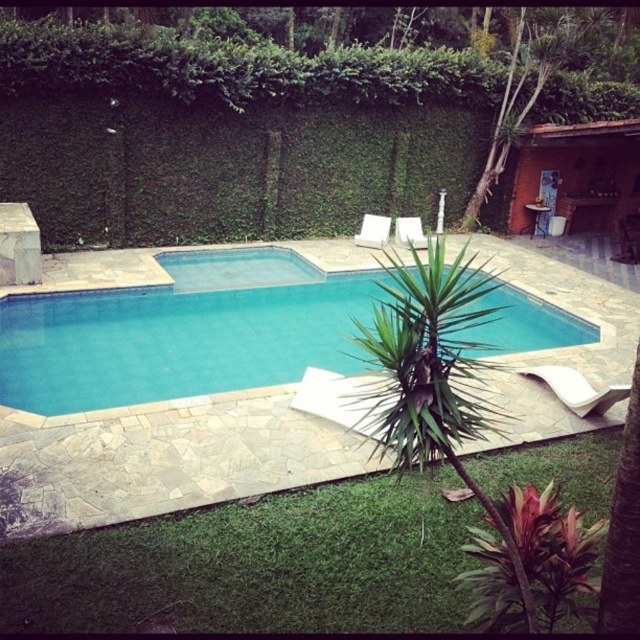
Is green leafy hedge at upper center above blue smooth pool at center?

Yes.

Is green leafy hedge at upper center closer to the viewer compared to blue smooth pool at center?

No, it is not.

What do you see at coordinates (230, 132) in the screenshot? This screenshot has height=640, width=640. I see `green leafy hedge at upper center` at bounding box center [230, 132].

Where is `green leafy hedge at upper center`? The image size is (640, 640). green leafy hedge at upper center is located at coordinates (230, 132).